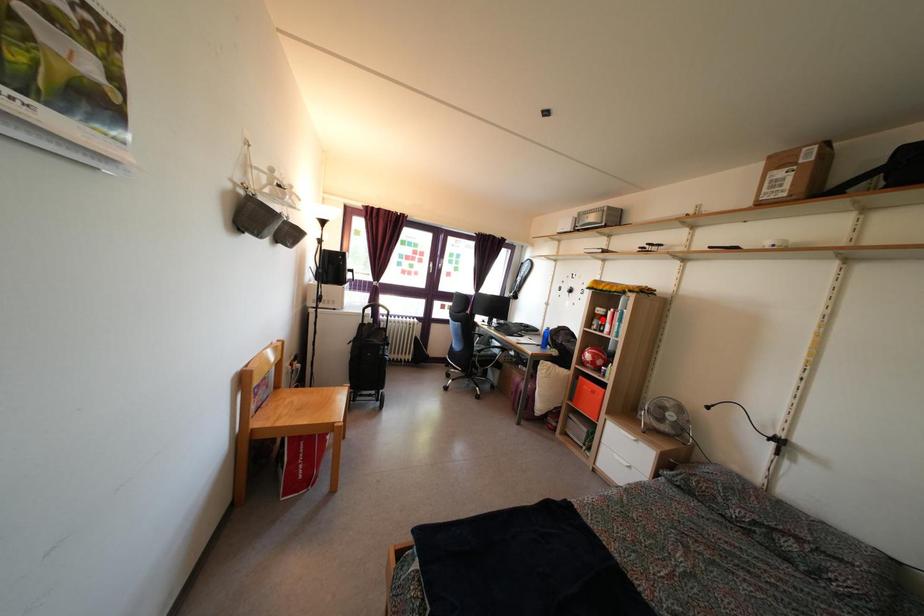
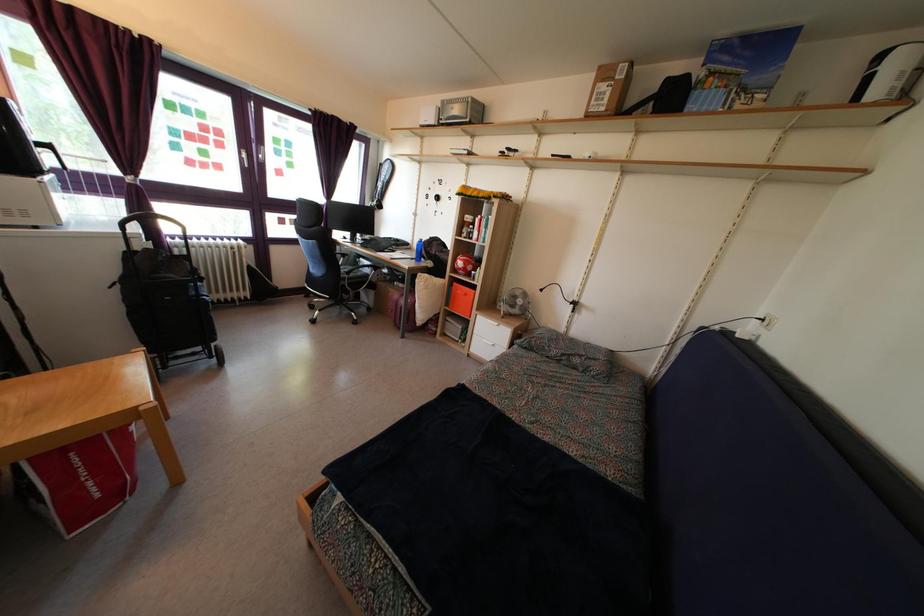
Question: I am providing you with two images of the same scene from different viewpoints. Given a red point in image1, look at the same physical point in image2. Is it:

Choices:
 (A) Closer to the viewpoint
 (B) Farther from the viewpoint

Answer: (A)